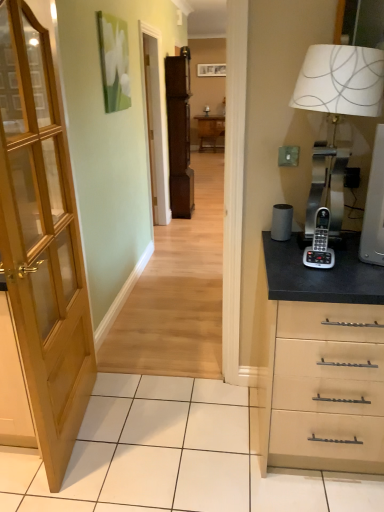
Locate an element on the screen. The height and width of the screenshot is (512, 384). matte wooden screen door at center is located at coordinates (154, 121).

What is the approximate height of brown wood file cabinet at center?

brown wood file cabinet at center is 5.97 feet in height.

This screenshot has width=384, height=512. Identify the location of matte wooden screen door at center. pyautogui.click(x=154, y=121).

In order to click on screen door above the silver metallic phone at right (from the image's perspective) in this screenshot , I will do `click(154, 121)`.

Is silver metallic phone at right taller or shorter than matte wooden screen door at center?

silver metallic phone at right is shorter than matte wooden screen door at center.

How distant is silver metallic phone at right from matte wooden screen door at center?

A distance of 3.16 meters exists between silver metallic phone at right and matte wooden screen door at center.

Which is correct: silver metallic phone at right is inside matte wooden screen door at center, or outside of it?

silver metallic phone at right exists outside the volume of matte wooden screen door at center.

Does metallic silver table lamp at right have a larger size compared to wooden picture frame at upper center?

Yes.

Considering the relative sizes of metallic silver table lamp at right and wooden picture frame at upper center in the image provided, is metallic silver table lamp at right taller than wooden picture frame at upper center?

Yes.

From a real-world perspective, between metallic silver table lamp at right and wooden picture frame at upper center, who is vertically lower?

metallic silver table lamp at right, from a real-world perspective.

From a real-world perspective, between wooden door at left and silver metallic phone at right, who is vertically higher?

silver metallic phone at right is physically above.

Is wooden door at left outside of silver metallic phone at right?

Yes, wooden door at left is not within silver metallic phone at right.

Based on the photo, from their relative heights in the image, would you say wooden door at left is taller or shorter than silver metallic phone at right?

Considering their sizes, wooden door at left has more height than silver metallic phone at right.

From the image's perspective, is brown wood file cabinet at center positioned above or below matte wooden screen door at center?

brown wood file cabinet at center is situated higher than matte wooden screen door at center in the image.

Looking at this image, is brown wood file cabinet at center wider than matte wooden screen door at center?

Indeed, brown wood file cabinet at center has a greater width compared to matte wooden screen door at center.

From a real-world perspective, does brown wood file cabinet at center sit lower than matte wooden screen door at center?

Yes, from a real-world perspective, brown wood file cabinet at center is beneath matte wooden screen door at center.

From the picture: Measure the distance from brown wood file cabinet at center to matte wooden screen door at center.

brown wood file cabinet at center is 11.50 inches away from matte wooden screen door at center.

Can you tell me how much wooden picture frame at upper center and metallic silver table lamp at right differ in facing direction?

They differ by 12.3 degrees in their facing directions.

From the image's perspective, is wooden picture frame at upper center under metallic silver table lamp at right?

Actually, wooden picture frame at upper center appears above metallic silver table lamp at right in the image.

Considering the relative positions of wooden picture frame at upper center and metallic silver table lamp at right in the image provided, is wooden picture frame at upper center to the right of metallic silver table lamp at right from the viewer's perspective?

No, wooden picture frame at upper center is not to the right of metallic silver table lamp at right.

Is wooden picture frame at upper center in front of metallic silver table lamp at right?

No, wooden picture frame at upper center is further to the viewer.

The height and width of the screenshot is (512, 384). Find the location of `file cabinet lying in front of the wooden table at center`. file cabinet lying in front of the wooden table at center is located at coordinates (179, 134).

Is wooden table at center positioned beyond the bounds of brown wood file cabinet at center?

Indeed, wooden table at center is completely outside brown wood file cabinet at center.

Which object is more forward, wooden table at center or brown wood file cabinet at center?

brown wood file cabinet at center.

Is metallic silver table lamp at right touching matte wooden screen door at center?

No, metallic silver table lamp at right is not with matte wooden screen door at center.

Between metallic silver table lamp at right and matte wooden screen door at center, which one is positioned in front?

metallic silver table lamp at right is closer to the camera.

Which of these two, metallic silver table lamp at right or matte wooden screen door at center, is thinner?

Thinner between the two is matte wooden screen door at center.

This screenshot has width=384, height=512. I want to click on table lamp below the matte wooden screen door at center (from the image's perspective), so click(x=340, y=81).

Locate an element on the screen. screen door behind the silver metallic phone at right is located at coordinates (154, 121).

Where is `table lamp below the wooden picture frame at upper center (from the image's perspective)`? table lamp below the wooden picture frame at upper center (from the image's perspective) is located at coordinates (340, 81).

Based on their spatial positions, is wooden table at center or silver metallic phone at right further from matte wooden screen door at center?

wooden table at center.

Estimate the real-world distances between objects in this image. Which object is closer to wooden picture frame at upper center, silver metallic phone at right or matte wooden screen door at center?

matte wooden screen door at center is closer to wooden picture frame at upper center.

Which object lies further to the anchor point matte wooden screen door at center, wooden picture frame at upper center or wooden table at center?

wooden picture frame at upper center.

In the scene shown: Considering their positions, is matte wooden screen door at center positioned further to silver metallic phone at right than wooden door at left?

The object further to silver metallic phone at right is matte wooden screen door at center.

Which object lies further to the anchor point wooden picture frame at upper center, wooden table at center or brown wood file cabinet at center?

brown wood file cabinet at center.

Considering their positions, is silver metallic phone at right positioned closer to brown wood file cabinet at center than wooden table at center?

Among the two, silver metallic phone at right is located nearer to brown wood file cabinet at center.

Looking at the image, which one is located further to wooden picture frame at upper center, metallic silver table lamp at right or silver metallic phone at right?

silver metallic phone at right lies further to wooden picture frame at upper center than the other object.

From the picture: Looking at the image, which one is located closer to metallic silver table lamp at right, matte wooden screen door at center or brown wood file cabinet at center?

Based on the image, matte wooden screen door at center appears to be nearer to metallic silver table lamp at right.

Where is `screen door between wooden door at left and brown wood file cabinet at center from front to back`? The width and height of the screenshot is (384, 512). screen door between wooden door at left and brown wood file cabinet at center from front to back is located at coordinates (154, 121).

Where is `gadget between metallic silver table lamp at right and wooden picture frame at upper center from front to back`? Image resolution: width=384 pixels, height=512 pixels. gadget between metallic silver table lamp at right and wooden picture frame at upper center from front to back is located at coordinates (320, 243).

Locate an element on the screen. The height and width of the screenshot is (512, 384). picture frame between wooden door at left and wooden table at center along the z-axis is located at coordinates (211, 70).

Where is `file cabinet positioned between silver metallic phone at right and wooden picture frame at upper center from near to far`? The width and height of the screenshot is (384, 512). file cabinet positioned between silver metallic phone at right and wooden picture frame at upper center from near to far is located at coordinates (179, 134).